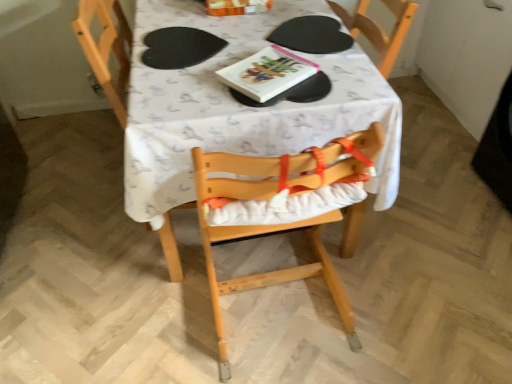
What do you see at coordinates (267, 73) in the screenshot? I see `hardcover book at center` at bounding box center [267, 73].

The height and width of the screenshot is (384, 512). I want to click on natural wood highchair at center, so click(281, 224).

This screenshot has width=512, height=384. What do you see at coordinates (281, 224) in the screenshot?
I see `natural wood highchair at center` at bounding box center [281, 224].

At what (x,y) coordinates should I click in order to perform the action: click on hardcover book at center. Please return your answer as a coordinate pair (x, y). Looking at the image, I should click on click(x=267, y=73).

How different are the orientations of hardcover book at center and natural wood highchair at center in degrees?

146 degrees separate the facing orientations of hardcover book at center and natural wood highchair at center.

In terms of size, does hardcover book at center appear bigger or smaller than natural wood highchair at center?

Clearly, hardcover book at center is smaller in size than natural wood highchair at center.

Find the location of `book that appears behind the natural wood highchair at center`. book that appears behind the natural wood highchair at center is located at coordinates (267, 73).

You are a GUI agent. You are given a task and a screenshot of the screen. Output one action in this format:
    pyautogui.click(x=<x>, y=<y>)
    Task: Click on the paper plate on the right of white fabric table at center
    The image size is (512, 384).
    Given the screenshot: What is the action you would take?
    pyautogui.click(x=311, y=35)

Which object is further away from the camera, white fabric table at center or black matte paper plate at center?

Positioned behind is black matte paper plate at center.

Is white fabric table at center positioned with its back to black matte paper plate at center?

No, black matte paper plate at center is not at the back of white fabric table at center.

Considering the sizes of white fabric table at center and black matte paper plate at center in the image, is white fabric table at center bigger or smaller than black matte paper plate at center?

Clearly, white fabric table at center is larger in size than black matte paper plate at center.

Does point (262, 56) come closer to viewer compared to point (323, 35)?

Yes, point (262, 56) is in front of point (323, 35).

Is hardcover book at center looking in the opposite direction of black matte paper plate at center?

No, hardcover book at center is not facing the opposite direction of black matte paper plate at center.

How many degrees apart are the facing directions of hardcover book at center and black matte paper plate at center?

They differ by 124 degrees in their facing directions.

Do you think hardcover book at center is within black matte paper plate at center, or outside of it?

hardcover book at center is located beyond the bounds of black matte paper plate at center.

Is hardcover book at center completely or partially inside black matte paper plate at center?

No, black matte paper plate at center does not contain hardcover book at center.

Considering the positions of objects black matte paper plate at center and hardcover book at center in the image provided, who is more to the right, black matte paper plate at center or hardcover book at center?

From the viewer's perspective, black matte paper plate at center appears more on the right side.

Can you confirm if black matte paper plate at center is smaller than hardcover book at center?

Actually, black matte paper plate at center might be larger than hardcover book at center.

Where is `table directly beneath the natural wood highchair at center (from a real-world perspective)`? This screenshot has height=384, width=512. table directly beneath the natural wood highchair at center (from a real-world perspective) is located at coordinates (239, 112).

Is white fabric table at center not within natural wood highchair at center?

Yes, white fabric table at center is outside of natural wood highchair at center.

Does white fabric table at center have a larger size compared to natural wood highchair at center?

Yes.

Is white fabric table at center touching natural wood highchair at center?

They are not placed beside each other.

Is black matte paper plate at center positioned far away from white fabric table at center?

No, black matte paper plate at center is not far from white fabric table at center.

This screenshot has height=384, width=512. I want to click on table in front of the black matte paper plate at center, so [239, 112].

From the image's perspective, does black matte paper plate at center appear lower than white fabric table at center?

No.

From a real-world perspective, which object stands above the other?

In real-world perspective, black matte paper plate at center is above.

From the image's perspective, is hardcover book at center located beneath white fabric table at center?

No, from the image's perspective, hardcover book at center is not below white fabric table at center.

Is white fabric table at center inside hardcover book at center?

No, white fabric table at center is not a part of hardcover book at center.

Considering the sizes of hardcover book at center and white fabric table at center in the image, is hardcover book at center taller or shorter than white fabric table at center?

In the image, hardcover book at center appears to be shorter than white fabric table at center.

Where is `chair directly beneath the hardcover book at center (from a real-world perspective)`? Image resolution: width=512 pixels, height=384 pixels. chair directly beneath the hardcover book at center (from a real-world perspective) is located at coordinates (281, 224).

Where is `paper plate behind the white fabric table at center`? The height and width of the screenshot is (384, 512). paper plate behind the white fabric table at center is located at coordinates (311, 35).

Estimate the real-world distances between objects in this image. Which object is closer to white fabric table at center, natural wood highchair at center or hardcover book at center?

Based on the image, hardcover book at center appears to be nearer to white fabric table at center.

Estimate the real-world distances between objects in this image. Which object is closer to black matte paper plate at center, white fabric table at center or natural wood highchair at center?

Based on the image, white fabric table at center appears to be nearer to black matte paper plate at center.

From the picture: Which object lies nearer to the anchor point white fabric table at center, hardcover book at center or black matte paper plate at center?

hardcover book at center.

Which object lies nearer to the anchor point black matte paper plate at center, natural wood highchair at center or white fabric table at center?

Among the two, white fabric table at center is located nearer to black matte paper plate at center.

Looking at the image, which one is located further to hardcover book at center, black matte paper plate at center or white fabric table at center?

white fabric table at center lies further to hardcover book at center than the other object.

From the image, which object appears to be farther from white fabric table at center, black matte paper plate at center or natural wood highchair at center?

black matte paper plate at center lies further to white fabric table at center than the other object.

Which object lies further to the anchor point natural wood highchair at center, white fabric table at center or black matte paper plate at center?

black matte paper plate at center.

Considering their positions, is white fabric table at center positioned further to black matte paper plate at center than hardcover book at center?

white fabric table at center.

Where is `table between hardcover book at center and natural wood highchair at center vertically`? table between hardcover book at center and natural wood highchair at center vertically is located at coordinates (239, 112).

Locate an element on the screen. This screenshot has height=384, width=512. book that lies between black matte paper plate at center and natural wood highchair at center from top to bottom is located at coordinates (267, 73).

I want to click on table between black matte paper plate at center and natural wood highchair at center from top to bottom, so click(239, 112).

I want to click on book between white fabric table at center and black matte paper plate at center from front to back, so click(x=267, y=73).